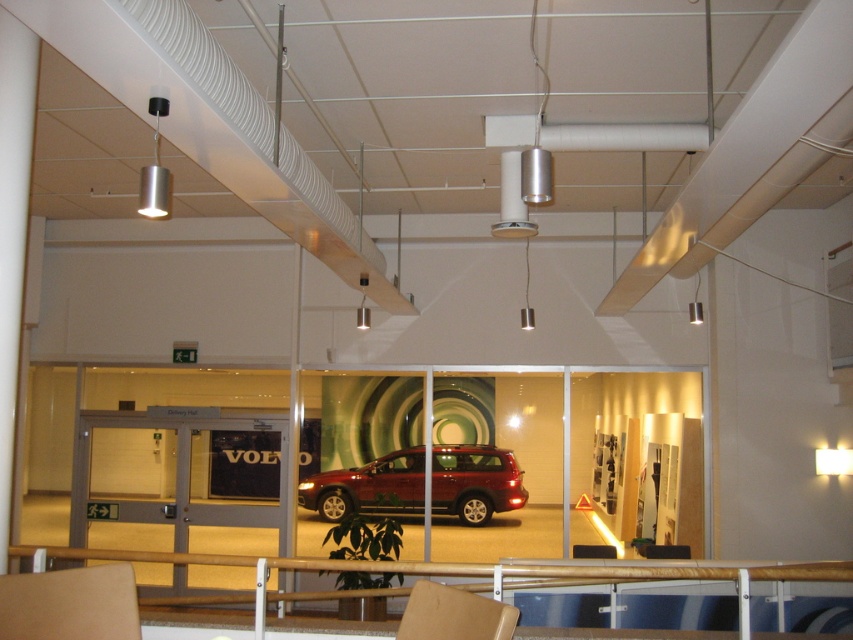
Between point (35, 614) and point (473, 604), which one is positioned behind?

The point (35, 614) is behind.

Who is shorter, matte brown chair at lower left or matte brown chair at center?

matte brown chair at lower left is shorter.

Describe the element at coordinates (70, 604) in the screenshot. The image size is (853, 640). I see `matte brown chair at lower left` at that location.

Where is `matte brown chair at lower left`? The image size is (853, 640). matte brown chair at lower left is located at coordinates (70, 604).

Based on the photo, does shiny metallic car at center appear over matte brown chair at lower left?

Actually, shiny metallic car at center is below matte brown chair at lower left.

Between shiny metallic car at center and matte brown chair at lower left, which one is positioned higher?

matte brown chair at lower left is above.

Between point (512, 500) and point (10, 632), which one is positioned in front?

Point (10, 632)

Where is `shiny metallic car at center`? shiny metallic car at center is located at coordinates (368, 486).

Who is more forward, (312,477) or (512,611)?

Point (512,611)

Is shiny metallic car at center above matte brown chair at center?

Actually, shiny metallic car at center is below matte brown chair at center.

The height and width of the screenshot is (640, 853). I want to click on shiny metallic car at center, so click(x=368, y=486).